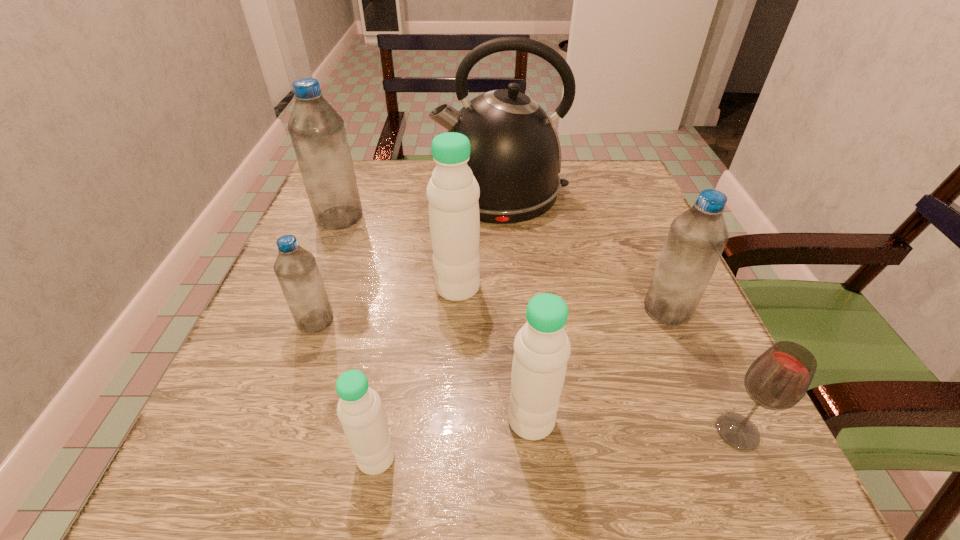
The height and width of the screenshot is (540, 960). Identify the location of white water bottle object that ranks as the second closest to the glass drink container. (453, 192).

Identify the location of vacant space that satisfies the following two spatial constraints: 1. on the spout of the kettle; 2. on the front side of the smallest blue water bottle. The width and height of the screenshot is (960, 540). (510, 321).

Where is `blank area in the image that satisfies the following two spatial constraints: 1. on the back side of the fourth water bottle from right to left; 2. on the right side of the fourth water bottle from left to right`? This screenshot has width=960, height=540. blank area in the image that satisfies the following two spatial constraints: 1. on the back side of the fourth water bottle from right to left; 2. on the right side of the fourth water bottle from left to right is located at coordinates (406, 287).

The width and height of the screenshot is (960, 540). Find the location of `vacant space that satisfies the following two spatial constraints: 1. on the back side of the smallest white water bottle; 2. on the right side of the glass drink container`. vacant space that satisfies the following two spatial constraints: 1. on the back side of the smallest white water bottle; 2. on the right side of the glass drink container is located at coordinates (381, 432).

Locate an element on the screen. Image resolution: width=960 pixels, height=540 pixels. blank area in the image that satisfies the following two spatial constraints: 1. on the spout of the kettle; 2. on the right side of the rightmost water bottle is located at coordinates (509, 309).

Image resolution: width=960 pixels, height=540 pixels. I want to click on blank space that satisfies the following two spatial constraints: 1. on the spout of the rightmost water bottle; 2. on the right side of the black kettle, so click(x=509, y=309).